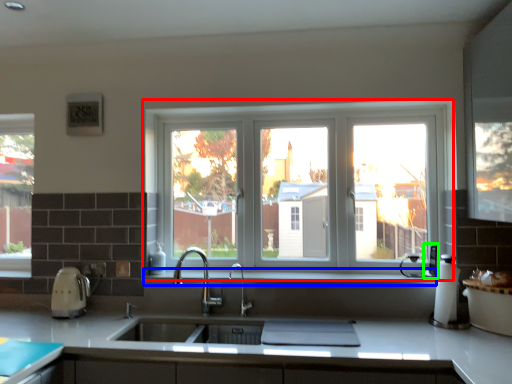
Question: Considering the real-world distances, which object is farthest from window (highlighted by a red box)? window sill (highlighted by a blue box) or appliance (highlighted by a green box)?

Choices:
 (A) window sill
 (B) appliance

Answer: (B)